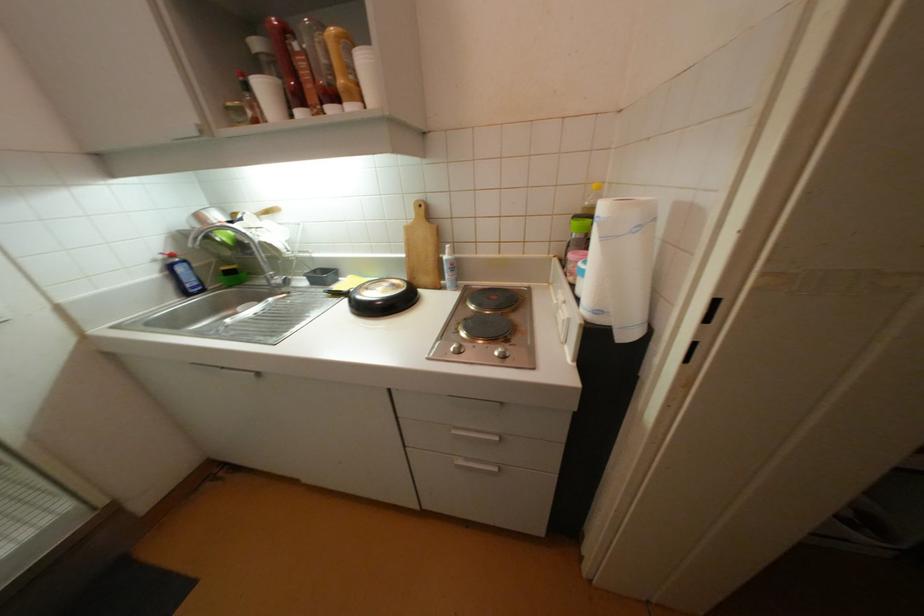
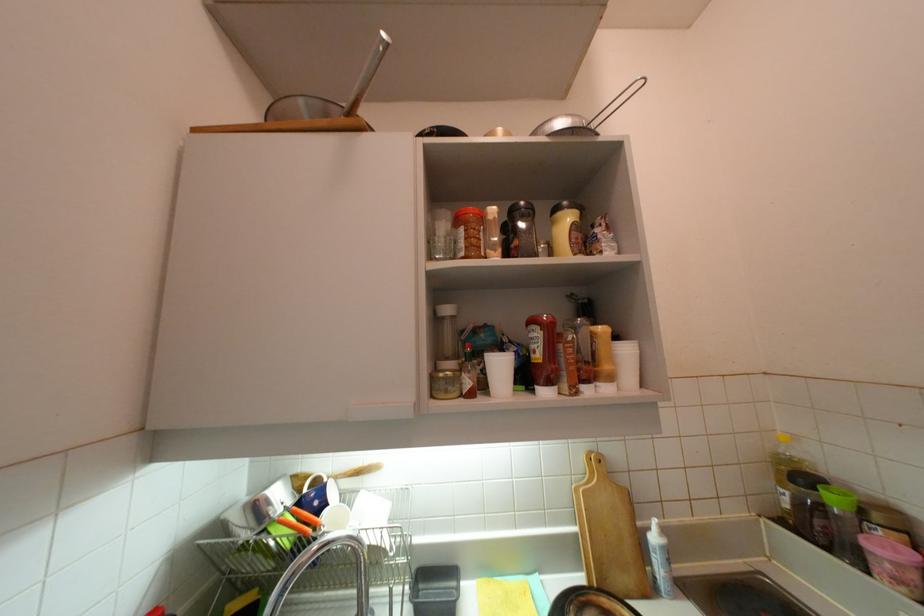
The point at [451,257] is marked in the first image. Where is the corresponding point in the second image?

(660, 540)